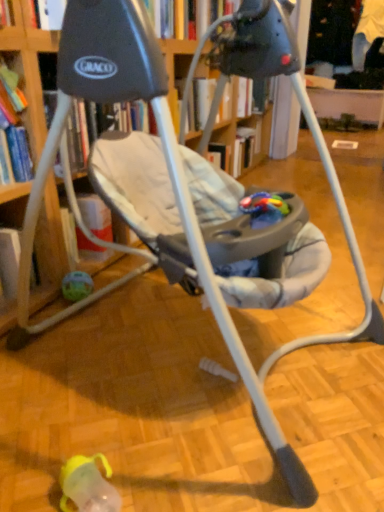
Question: In which direction should I rotate to look at rubberized plastic teething toy at center, positioned as the 1th toy in front-to-back order?

Choices:
 (A) left
 (B) right

Answer: (B)

Question: Can you confirm if translucent plastic ball at lower left, the first toy positioned from the back, is thinner than rubberized plastic teething toy at center, which ranks as the second toy in bottom-to-top order?

Choices:
 (A) no
 (B) yes

Answer: (B)

Question: From the image's perspective, is translucent plastic ball at lower left, the first toy in the bottom-to-top sequence, above rubberized plastic teething toy at center, which appears as the 1th toy when viewed from the right?

Choices:
 (A) yes
 (B) no

Answer: (B)

Question: Is translucent plastic ball at lower left, the second toy when ordered from top to bottom, oriented towards rubberized plastic teething toy at center, acting as the second toy starting from the left?

Choices:
 (A) no
 (B) yes

Answer: (A)

Question: Is translucent plastic ball at lower left, the first toy positioned from the back, shorter than rubberized plastic teething toy at center, acting as the second toy starting from the left?

Choices:
 (A) no
 (B) yes

Answer: (A)

Question: Is translucent plastic ball at lower left, placed as the 2th toy when sorted from right to left, next to rubberized plastic teething toy at center, positioned as the 1th toy in front-to-back order?

Choices:
 (A) no
 (B) yes

Answer: (A)

Question: Is rubberized plastic teething toy at center, positioned as the 1th toy in front-to-back order, located within translucent plastic ball at lower left, the first toy in the bottom-to-top sequence?

Choices:
 (A) yes
 (B) no

Answer: (B)

Question: Does rubberized plastic teething toy at center, acting as the 2th toy starting from the back, appear on the left side of translucent plastic ball at lower left, placed as the 2th toy when sorted from right to left?

Choices:
 (A) no
 (B) yes

Answer: (A)

Question: Considering the relative sizes of rubberized plastic teething toy at center, which ranks as the second toy in bottom-to-top order, and translucent plastic ball at lower left, the second toy when ordered from top to bottom, in the image provided, is rubberized plastic teething toy at center, which ranks as the second toy in bottom-to-top order, taller than translucent plastic ball at lower left, the second toy when ordered from top to bottom,?

Choices:
 (A) yes
 (B) no

Answer: (B)

Question: Is rubberized plastic teething toy at center, which ranks as the second toy in bottom-to-top order, positioned with its back to translucent plastic ball at lower left, the 1th toy from the left?

Choices:
 (A) yes
 (B) no

Answer: (B)

Question: Does rubberized plastic teething toy at center, acting as the 2th toy starting from the back, contain translucent plastic ball at lower left, placed as the 2th toy when sorted from right to left?

Choices:
 (A) yes
 (B) no

Answer: (B)

Question: From a real-world perspective, is rubberized plastic teething toy at center, which appears as the 1th toy when viewed from the right, positioned under translucent plastic ball at lower left, the first toy in the bottom-to-top sequence, based on gravity?

Choices:
 (A) yes
 (B) no

Answer: (B)

Question: Is rubberized plastic teething toy at center, acting as the 2th toy starting from the back, next to translucent plastic ball at lower left, the 1th toy from the left, and touching it?

Choices:
 (A) no
 (B) yes

Answer: (A)

Question: Which is correct: rubberized plastic teething toy at center, which appears as the 1th toy when viewed from the right, is inside translucent plastic ball at lower left, the second toy when ordered from top to bottom, or outside of it?

Choices:
 (A) inside
 (B) outside

Answer: (B)